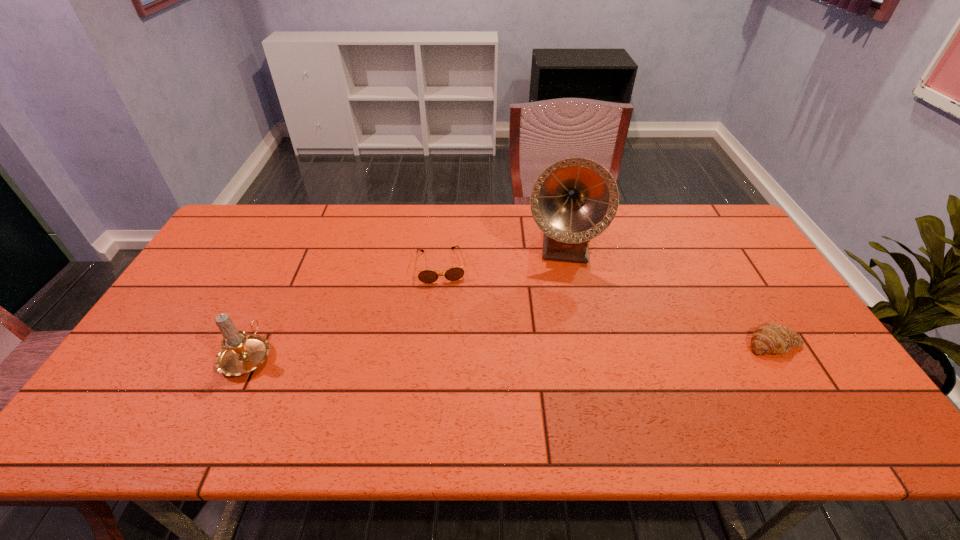
At what (x,y) coordinates should I click in order to perform the action: click on blank region between the sunglasses and the crescent roll. Please return your answer as a coordinate pair (x, y). The height and width of the screenshot is (540, 960). Looking at the image, I should click on (608, 305).

At what (x,y) coordinates should I click in order to perform the action: click on object that stands as the third closest to the second tallest object. Please return your answer as a coordinate pair (x, y). Looking at the image, I should click on (768, 338).

I want to click on the second closest object to the crescent roll, so click(x=426, y=276).

What are the coordinates of `vacant space that satisfies the following two spatial constraints: 1. on the back side of the third object from left to right; 2. on the left side of the third shortest object` in the screenshot? It's located at point(299,247).